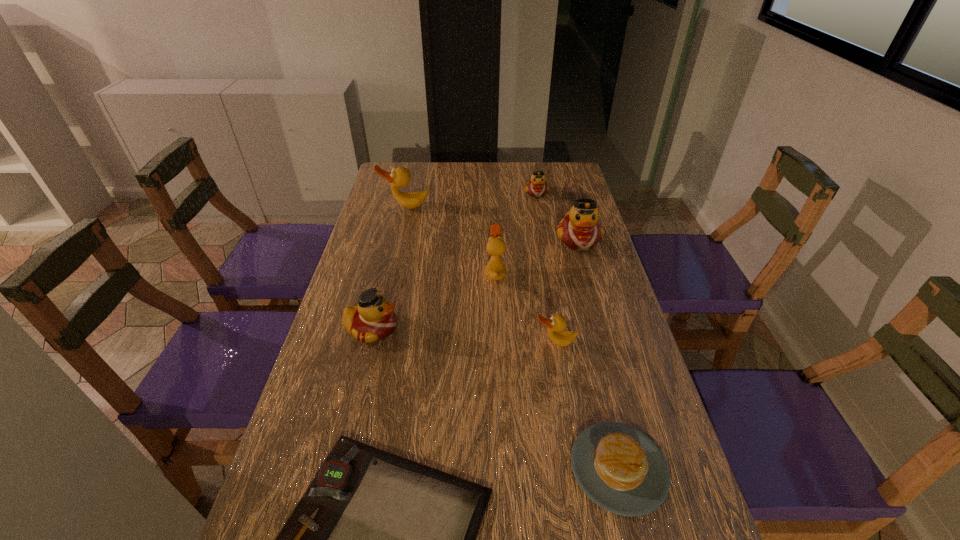
At what (x,y) coordinates should I click in order to perform the action: click on the smallest tan duck. Please return your answer as a coordinate pair (x, y). Looking at the image, I should click on (556, 324).

Locate an element on the screen. The width and height of the screenshot is (960, 540). the nearest tan duck is located at coordinates (556, 324).

Locate an element on the screen. the second shortest object is located at coordinates tap(618, 467).

Where is `vacant point located 0.230m on the face of the biggest red duck`? vacant point located 0.230m on the face of the biggest red duck is located at coordinates (598, 307).

At what (x,y) coordinates should I click in order to perform the action: click on vacant space positioned 0.070m on the beak of the second farthest object. Please return your answer as a coordinate pair (x, y). Image resolution: width=960 pixels, height=540 pixels. Looking at the image, I should click on click(x=401, y=224).

You are a GUI agent. You are given a task and a screenshot of the screen. Output one action in this format:
    pyautogui.click(x=<x>, y=<y>)
    Task: Click on the vacant area located on the face of the nearest red duck
    
    Given the screenshot: What is the action you would take?
    [497, 329]

This screenshot has width=960, height=540. What are the coordinates of `vacant space located on the beak of the second smallest tan duck` in the screenshot? It's located at (420, 273).

The image size is (960, 540). I want to click on vacant area located 0.360m on the beak of the second smallest tan duck, so click(x=367, y=273).

You are a GUI agent. You are given a task and a screenshot of the screen. Output one action in this format:
    pyautogui.click(x=<x>, y=<y>)
    Task: Click on the vacant space situated on the beak of the second smallest tan duck
    
    Given the screenshot: What is the action you would take?
    pyautogui.click(x=416, y=273)

Locate an element on the screen. The height and width of the screenshot is (540, 960). vacant space located 0.130m on the face of the farthest duck is located at coordinates (541, 219).